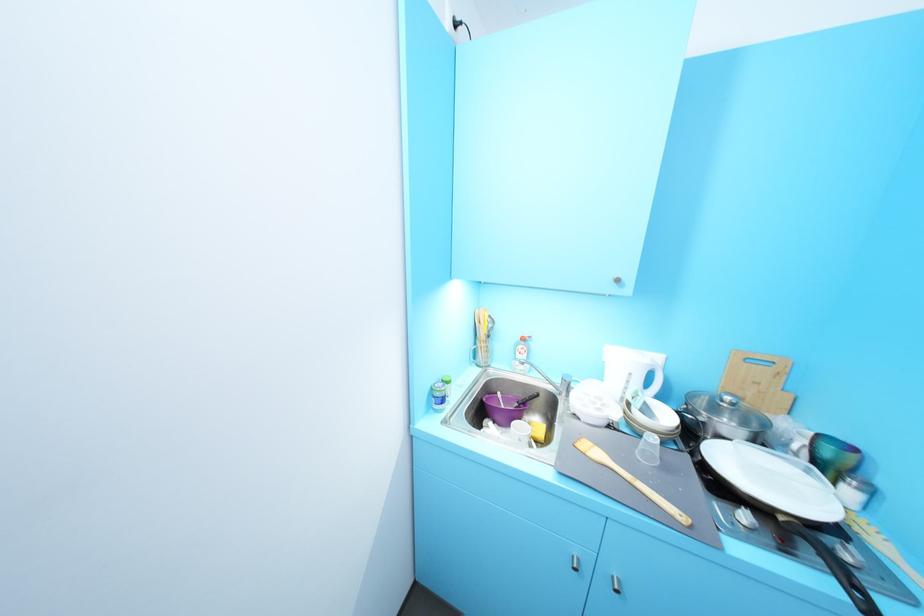
You are a GUI agent. You are given a task and a screenshot of the screen. Output one action in this format:
    pyautogui.click(x=<x>, y=<y>)
    Task: Click on the colorful bowl
    
    Given the screenshot: What is the action you would take?
    pyautogui.click(x=504, y=408)